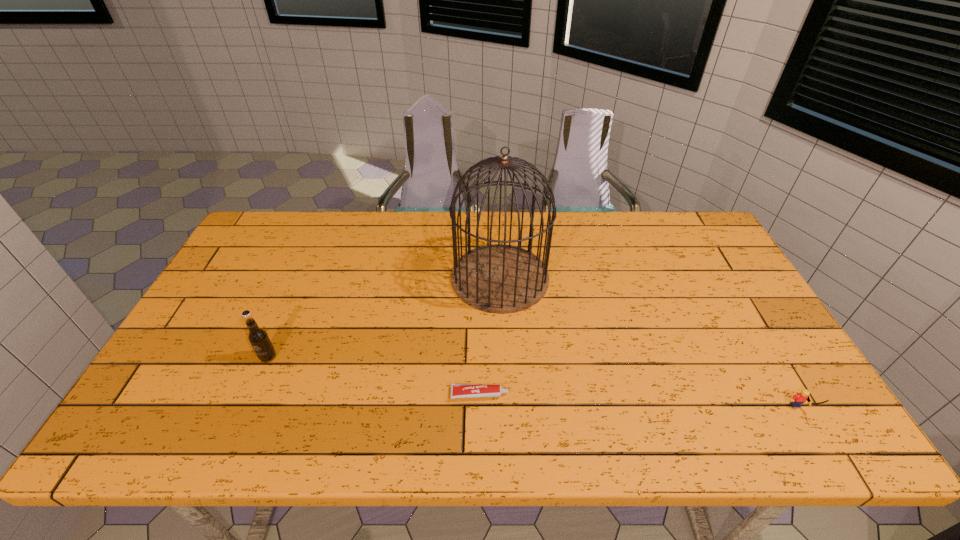
Where is `blank area located 0.220m at the door of the birdcage`? blank area located 0.220m at the door of the birdcage is located at coordinates (379, 278).

The width and height of the screenshot is (960, 540). I want to click on vacant space located 0.140m on the label of the root beer, so click(244, 414).

What are the coordinates of `vacant space located 0.350m at the nozzle of the third farthest object` in the screenshot? It's located at (655, 394).

At what (x,y) coordinates should I click in order to perform the action: click on object situated at the far edge. Please return your answer as a coordinate pair (x, y). This screenshot has width=960, height=540. Looking at the image, I should click on (501, 279).

The width and height of the screenshot is (960, 540). What are the coordinates of `object situated at the near edge` in the screenshot? It's located at (796, 401).

The image size is (960, 540). What are the coordinates of `object that is at the right edge` in the screenshot? It's located at (796, 401).

At what (x,y) coordinates should I click in order to perform the action: click on object positioned at the near right corner. Please return your answer as a coordinate pair (x, y). Looking at the image, I should click on (796, 401).

This screenshot has width=960, height=540. In the image, there is a desktop. What are the coordinates of `vacant space at the far edge` in the screenshot? It's located at (592, 213).

Find the location of a particular element. The height and width of the screenshot is (540, 960). vacant space at the near edge of the desktop is located at coordinates (230, 418).

You are a GUI agent. You are given a task and a screenshot of the screen. Output one action in this format:
    pyautogui.click(x=<x>, y=<y>)
    Task: Click on the vacant area at the left edge
    The width and height of the screenshot is (960, 540).
    Given the screenshot: What is the action you would take?
    pyautogui.click(x=227, y=338)